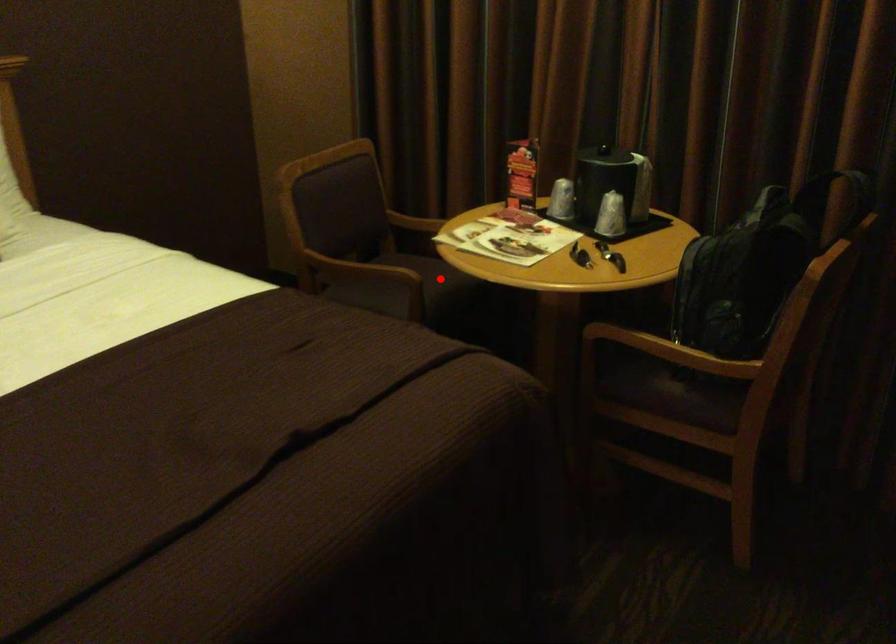
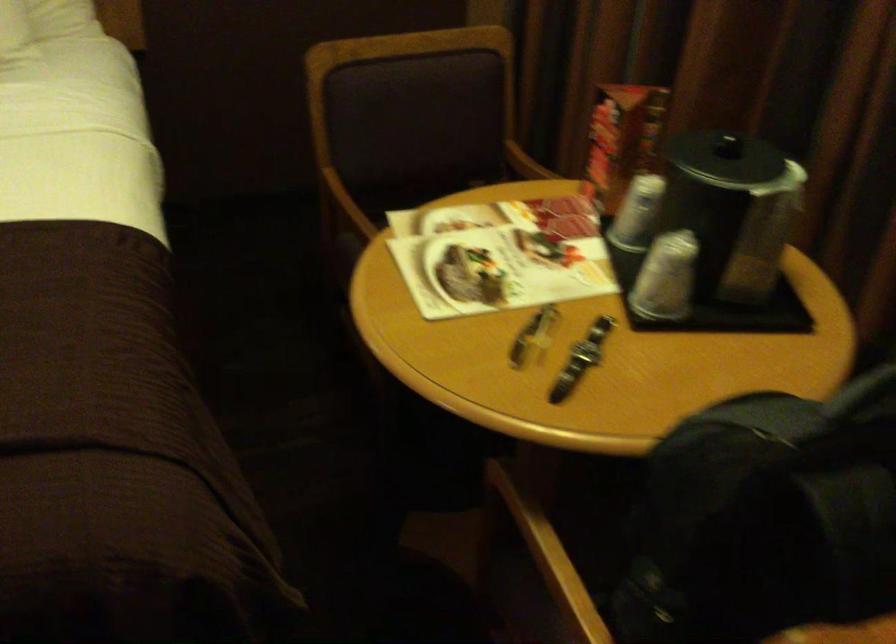
Question: I am providing you with two images of the same scene from different viewpoints. A red point is marked on the first image. Can you still see the location of the red point in image 2?

Choices:
 (A) Yes
 (B) No

Answer: (B)